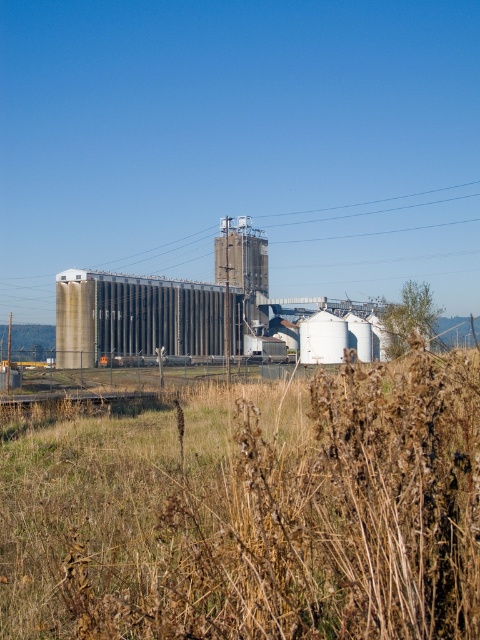
You are standing in the rural industrial area and see the brown dry grass at center and the metallic wire at upper center. Which object is positioned to the right of the other?

The metallic wire at upper center is positioned to the right of the brown dry grass at center.

What is the 2D coordinate of the brown dry grass at center in the image?

The brown dry grass at center is located at the 2D coordinate point of (252, 513).